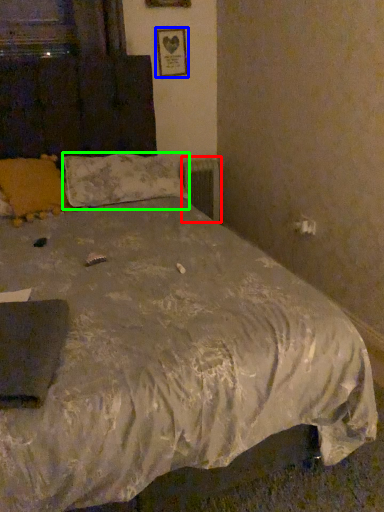
Question: Estimate the real-world distances between objects in this image. Which object is farther from radiator (highlighted by a red box), picture frame (highlighted by a blue box) or pillow (highlighted by a green box)?

Choices:
 (A) picture frame
 (B) pillow

Answer: (B)